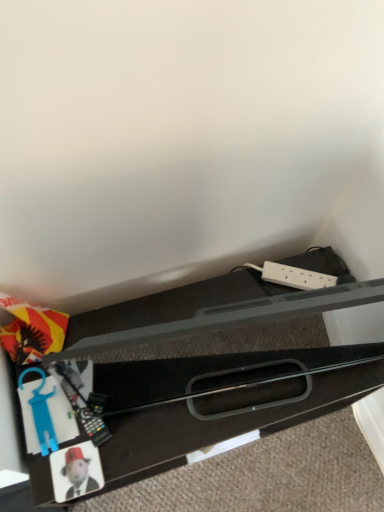
Question: Is matte plastic coaster at lower left, the 1th toy positioned from the bottom, aimed at blue plastic toy at lower left, which appears as the second toy when ordered from the bottom?

Choices:
 (A) yes
 (B) no

Answer: (B)

Question: Is the position of matte plastic coaster at lower left, the second toy viewed from the top, less distant than that of blue plastic toy at lower left, which appears as the second toy when ordered from the bottom?

Choices:
 (A) yes
 (B) no

Answer: (A)

Question: Does matte plastic coaster at lower left, the second toy viewed from the top, have a larger size compared to blue plastic toy at lower left, marked as the first toy in a top-to-bottom arrangement?

Choices:
 (A) no
 (B) yes

Answer: (A)

Question: From a real-world perspective, does matte plastic coaster at lower left, the second toy viewed from the top, stand above blue plastic toy at lower left, which appears as the second toy when ordered from the bottom?

Choices:
 (A) no
 (B) yes

Answer: (A)

Question: Is matte plastic coaster at lower left, the second toy viewed from the top, behind blue plastic toy at lower left, marked as the first toy in a top-to-bottom arrangement?

Choices:
 (A) yes
 (B) no

Answer: (B)

Question: Does matte plastic coaster at lower left, the 1th toy positioned from the bottom, have a smaller size compared to blue plastic toy at lower left, which appears as the second toy when ordered from the bottom?

Choices:
 (A) no
 (B) yes

Answer: (B)

Question: Is black plastic drawer at lower left at the left side of matte plastic coaster at lower left, the second toy viewed from the top?

Choices:
 (A) yes
 (B) no

Answer: (B)

Question: Considering the relative sizes of black plastic drawer at lower left and matte plastic coaster at lower left, the 1th toy positioned from the bottom, in the image provided, is black plastic drawer at lower left bigger than matte plastic coaster at lower left, the 1th toy positioned from the bottom,?

Choices:
 (A) no
 (B) yes

Answer: (B)

Question: Is black plastic drawer at lower left smaller than matte plastic coaster at lower left, the 1th toy positioned from the bottom?

Choices:
 (A) yes
 (B) no

Answer: (B)

Question: Can you see black plastic drawer at lower left touching matte plastic coaster at lower left, the 1th toy positioned from the bottom?

Choices:
 (A) no
 (B) yes

Answer: (A)

Question: Does black plastic drawer at lower left lie in front of matte plastic coaster at lower left, the second toy viewed from the top?

Choices:
 (A) yes
 (B) no

Answer: (A)

Question: Does black plastic drawer at lower left have a lesser height compared to matte plastic coaster at lower left, the second toy viewed from the top?

Choices:
 (A) no
 (B) yes

Answer: (A)

Question: From a real-world perspective, is blue plastic toy at lower left, marked as the first toy in a top-to-bottom arrangement, on matte plastic coaster at lower left, the 1th toy positioned from the bottom?

Choices:
 (A) yes
 (B) no

Answer: (A)